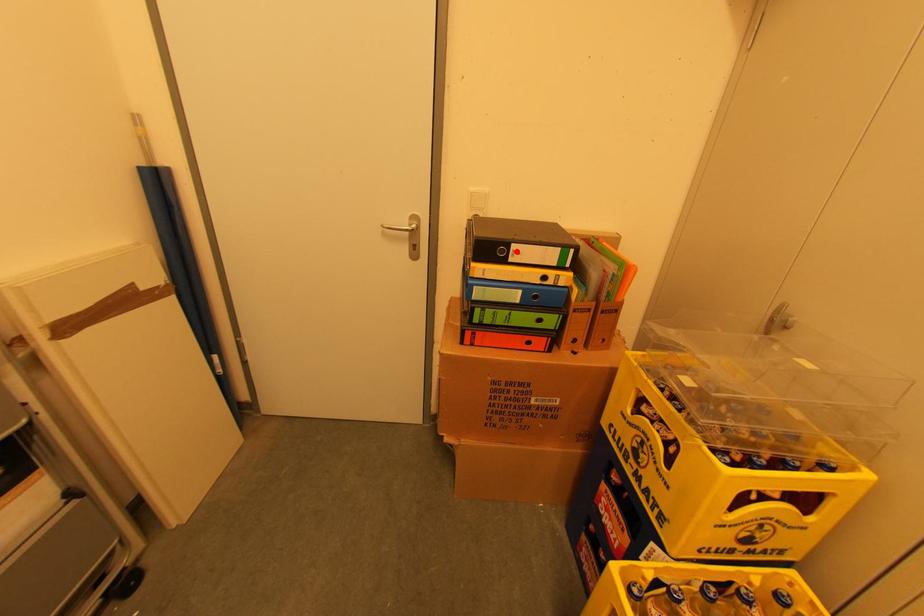
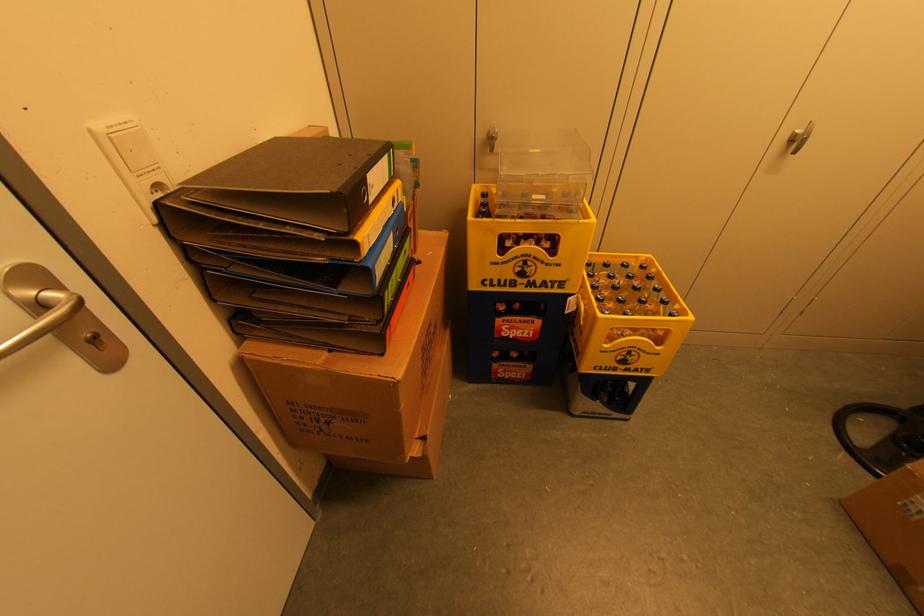
Find the pixel in the second image that matches the highlighted location in the first image.

(371, 185)